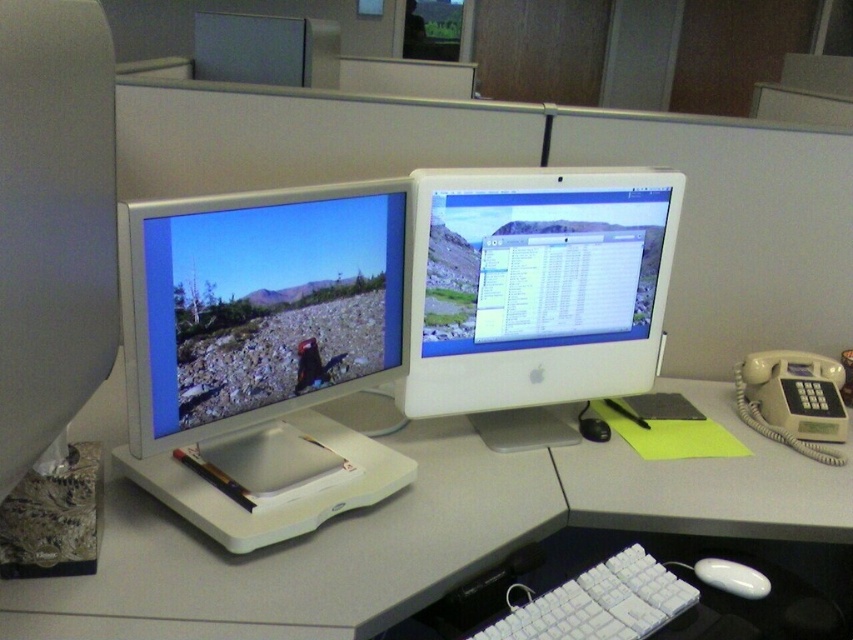
Question: Which object is the closest to the white plastic monitor at center?

Choices:
 (A) white glossy mouse at lower right
 (B) white plastic computer desk at center
 (C) satin silver monitor at left
 (D) black plastic mouse at center

Answer: (C)

Question: Based on their relative distances, which object is nearer to the satin silver monitor at left?

Choices:
 (A) white plastic keyboard at lower center
 (B) white plastic computer desk at center
 (C) white glossy mouse at lower right

Answer: (B)

Question: Does satin silver monitor at left appear on the right side of white glossy mouse at lower right?

Choices:
 (A) yes
 (B) no

Answer: (B)

Question: Which point appears farthest from the camera in this image?

Choices:
 (A) (109, 604)
 (B) (590, 374)

Answer: (B)

Question: Is white plastic monitor at center further to the viewer compared to white glossy mouse at lower right?

Choices:
 (A) no
 (B) yes

Answer: (B)

Question: Can you confirm if satin silver monitor at left is smaller than white glossy mouse at lower right?

Choices:
 (A) no
 (B) yes

Answer: (A)